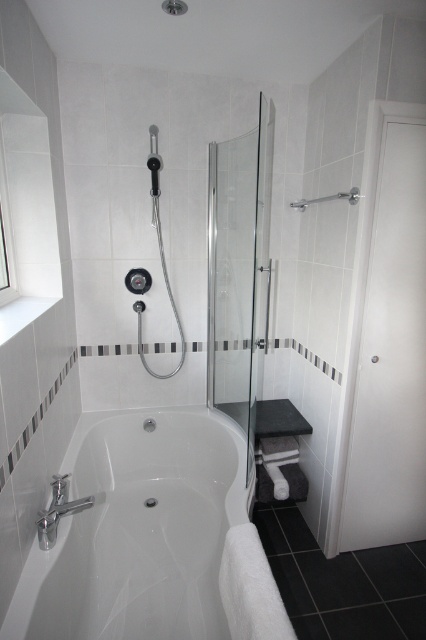
Question: Does white glossy bathtub at lower left have a greater width compared to silver metallic towel bar at upper right?

Choices:
 (A) no
 (B) yes

Answer: (B)

Question: Can you confirm if white matte door at right is thinner than transparent glass shower door at center?

Choices:
 (A) no
 (B) yes

Answer: (A)

Question: Among these objects, which one is nearest to the camera?

Choices:
 (A) white matte door at right
 (B) transparent glass shower door at center
 (C) silver metallic towel bar at upper right
 (D) white glossy bathtub at lower left

Answer: (D)

Question: Which point appears farthest from the camera in this image?

Choices:
 (A) (221, 148)
 (B) (88, 545)

Answer: (A)

Question: Based on their relative distances, which object is farther from the white glossy bathtub at lower left?

Choices:
 (A) silver metallic towel bar at upper right
 (B) transparent glass shower door at center

Answer: (A)

Question: Does white matte door at right appear under transparent glass shower door at center?

Choices:
 (A) no
 (B) yes

Answer: (B)